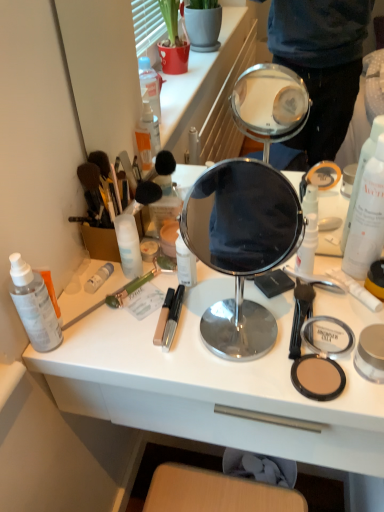
Question: Is matte yellow compact powder at right, placed as the 6th toiletry when sorted from left to right, far from polished silver mirror at center?

Choices:
 (A) yes
 (B) no

Answer: (B)

Question: Is matte yellow compact powder at right, the first toiletry when ordered from right to left, further to the viewer compared to polished silver mirror at center?

Choices:
 (A) no
 (B) yes

Answer: (B)

Question: Is matte yellow compact powder at right, placed as the 6th toiletry when sorted from left to right, positioned beyond the bounds of polished silver mirror at center?

Choices:
 (A) no
 (B) yes

Answer: (B)

Question: Considering the relative sizes of matte yellow compact powder at right, the first toiletry when ordered from right to left, and polished silver mirror at center in the image provided, is matte yellow compact powder at right, the first toiletry when ordered from right to left, shorter than polished silver mirror at center?

Choices:
 (A) no
 (B) yes

Answer: (B)

Question: Is matte yellow compact powder at right, placed as the 6th toiletry when sorted from left to right, touching polished silver mirror at center?

Choices:
 (A) yes
 (B) no

Answer: (B)

Question: Is matte yellow compact powder at right, placed as the 6th toiletry when sorted from left to right, taller than polished silver mirror at center?

Choices:
 (A) yes
 (B) no

Answer: (B)

Question: Is green plastic brush at lower left further to the viewer compared to white matte spray bottle at right?

Choices:
 (A) yes
 (B) no

Answer: (A)

Question: Is green plastic brush at lower left positioned with its back to white matte spray bottle at right?

Choices:
 (A) no
 (B) yes

Answer: (A)

Question: Is the surface of green plastic brush at lower left in direct contact with white matte spray bottle at right?

Choices:
 (A) no
 (B) yes

Answer: (A)

Question: From the image's perspective, would you say green plastic brush at lower left is shown under white matte spray bottle at right?

Choices:
 (A) no
 (B) yes

Answer: (B)

Question: Is green plastic brush at lower left wider than white matte spray bottle at right?

Choices:
 (A) yes
 (B) no

Answer: (A)

Question: Is green plastic brush at lower left at the right side of white matte spray bottle at right?

Choices:
 (A) no
 (B) yes

Answer: (A)